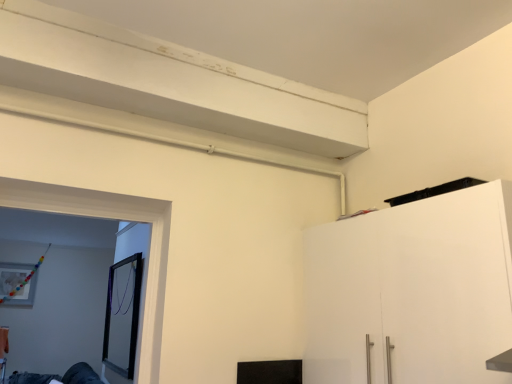
Measure the distance between point (483, 351) and camera.

Point (483, 351) and camera are 4.06 feet apart.

Locate an element on the screen. The height and width of the screenshot is (384, 512). white glossy cabinet at upper right is located at coordinates (412, 290).

Describe the element at coordinates (412, 290) in the screenshot. I see `white glossy cabinet at upper right` at that location.

This screenshot has width=512, height=384. In order to click on white glossy cabinet at upper right in this screenshot , I will do `click(412, 290)`.